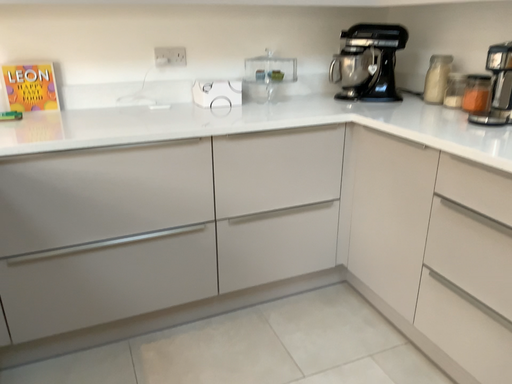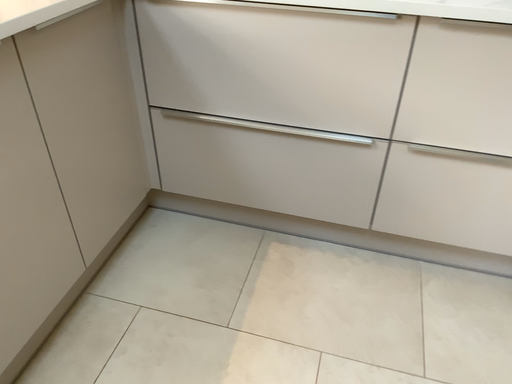
Question: Which way did the camera rotate in the video?

Choices:
 (A) rotated left
 (B) rotated right

Answer: (A)